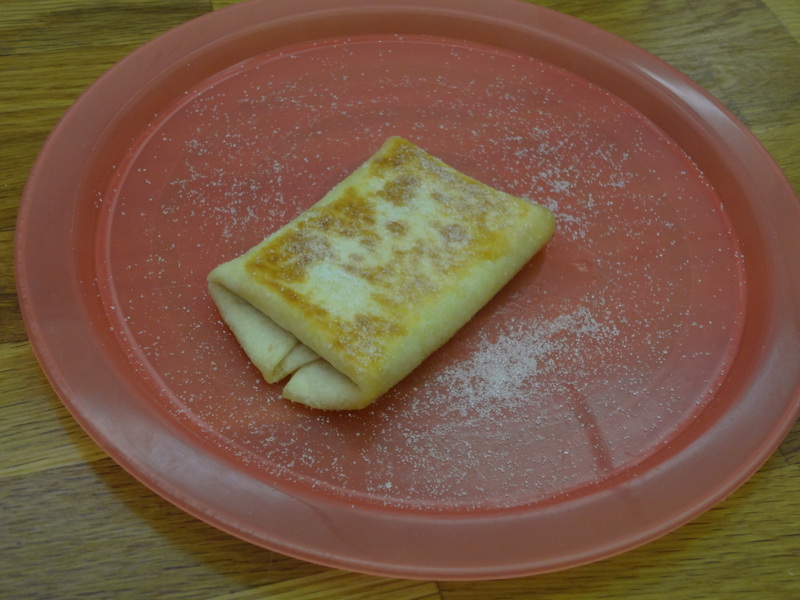
This screenshot has width=800, height=600. In order to click on light in this screenshot , I will do `click(692, 97)`.